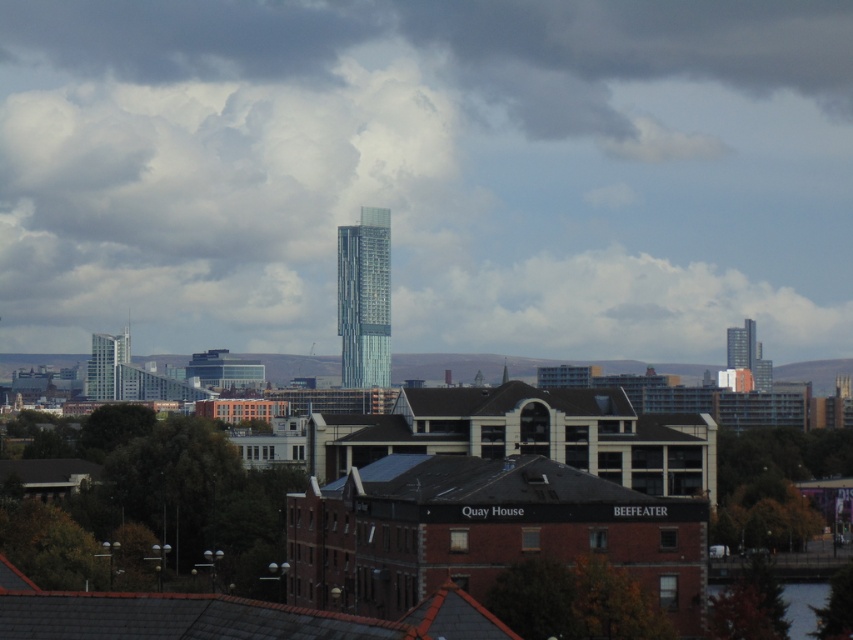
From the picture: You are an architect evaluating a city layout. You notice the cloudy sky at center and the glassy steel tower at upper right. Which of these two elements occupies a greater horizontal space in the image?

The cloudy sky at center occupies a greater horizontal space in the image because its width is larger than that of the glassy steel tower at upper right.

You are an urban planner assessing the city layout. You need to determine which of the two glassy structures, the glassy metallic skyscraper at center or the glassy steel tower at left, has a greater horizontal space requirement for construction. Based on the scene, which one requires more space?

The glassy metallic skyscraper at center has a greater horizontal space requirement because its width is larger than the glassy steel tower at left.